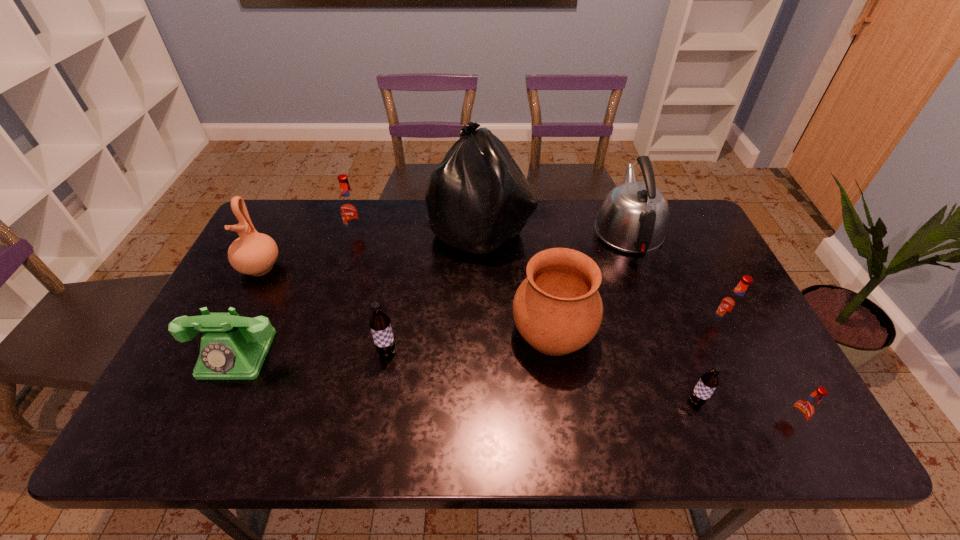
Locate an element on the screen. The image size is (960, 540). the tallest object is located at coordinates (477, 198).

Identify the location of kettle. The image size is (960, 540). (633, 218).

This screenshot has height=540, width=960. I want to click on the leftmost root beer, so click(350, 209).

Identify the location of the eighth object from right to left. coord(350,209).

Locate an element on the screen. This screenshot has height=540, width=960. the left pottery is located at coordinates (253, 253).

The image size is (960, 540). What are the coordinates of `the right pottery` in the screenshot? It's located at (557, 309).

Find the location of a particular element. the second root beer from left to right is located at coordinates (379, 323).

Find the location of a particular element. the seventh object from right to left is located at coordinates (379, 323).

Locate an element on the screen. the second biggest red root beer is located at coordinates (731, 306).

Locate an element on the screen. Image resolution: width=960 pixels, height=540 pixels. the second object from right to left is located at coordinates (731, 306).